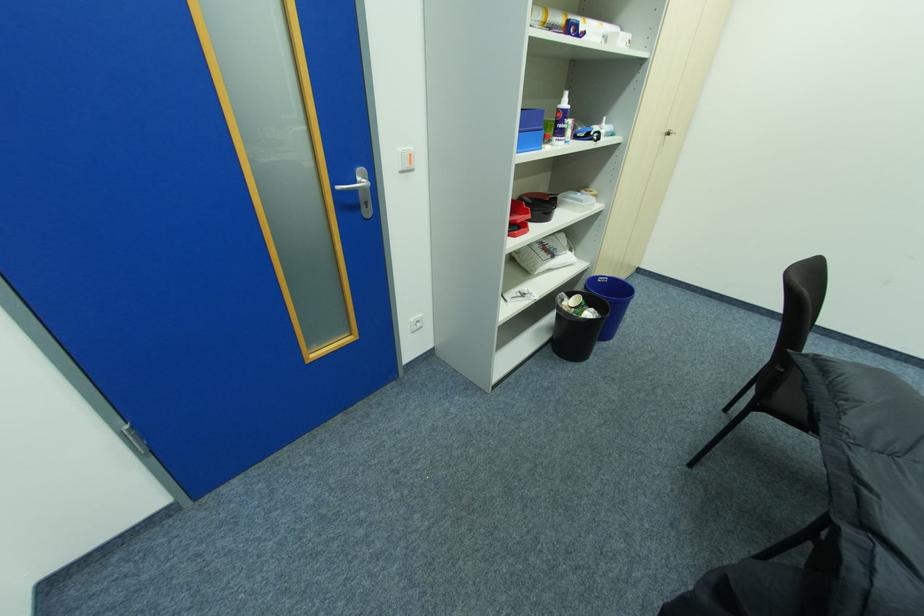
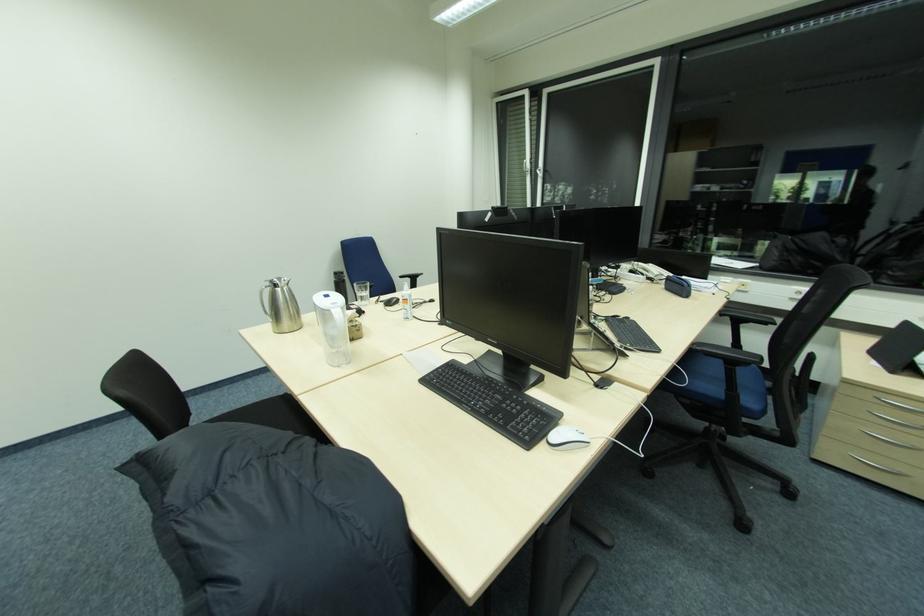
The first image is from the beginning of the video and the second image is from the end. How did the camera likely rotate when shooting the video?

The camera rotated toward right-down.